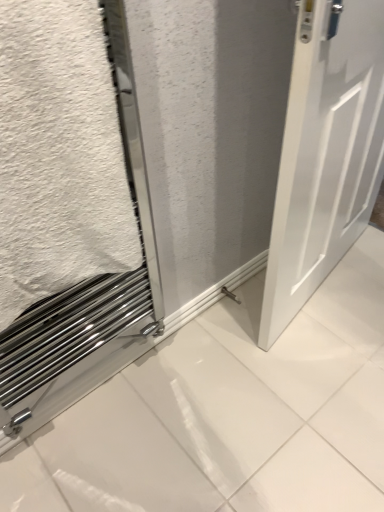
Where is `vacant area situated below white matte door at right (from a real-world perspective)`? vacant area situated below white matte door at right (from a real-world perspective) is located at coordinates (330, 283).